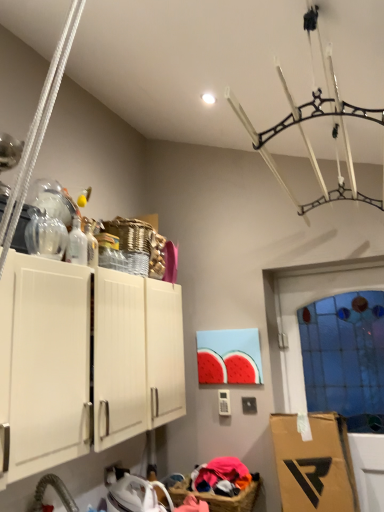
The width and height of the screenshot is (384, 512). What are the coordinates of `brown wicker basket at lower center` in the screenshot? It's located at (232, 499).

I want to click on basket behind the transparent glass bottle at upper left, placed as the 2th bottle when sorted from back to front, so click(232, 499).

From the image's perspective, which is above, brown wicker basket at lower center or transparent glass bottle at upper left, placed as the 2th bottle when sorted from back to front?

transparent glass bottle at upper left, placed as the 2th bottle when sorted from back to front, is shown above in the image.

In the scene shown: How distant is brown wicker basket at lower center from transparent glass bottle at upper left, placed as the 2th bottle when sorted from back to front?

4.37 feet.

Which is more to the right, brown wicker basket at lower center or transparent glass bottle at upper left, the first bottle viewed from the front?

brown wicker basket at lower center.

Which of these two, transparent glass door at right or transparent glass bottle at upper left, placed as the 2th bottle when sorted from back to front, is bigger?

Bigger between the two is transparent glass door at right.

Between transparent glass door at right and transparent glass bottle at upper left, placed as the 2th bottle when sorted from back to front, which one has smaller width?

transparent glass door at right is thinner.

Is transparent glass door at right to the right of transparent glass bottle at upper left, placed as the 2th bottle when sorted from back to front, from the viewer's perspective?

Indeed, transparent glass door at right is positioned on the right side of transparent glass bottle at upper left, placed as the 2th bottle when sorted from back to front.

Is transparent glass door at right behind transparent glass bottle at upper left, the first bottle viewed from the front?

Yes, it is.

Does transparent glass bottle at upper left, the first bottle viewed from the front, turn towards brown wicker basket at lower center?

No.

Considering the positions of point (84, 255) and point (219, 498), is point (84, 255) closer or farther from the camera than point (219, 498)?

Point (84, 255) appears to be closer to the viewer than point (219, 498).

Is transparent glass bottle at upper left, placed as the 2th bottle when sorted from back to front, bigger or smaller than brown wicker basket at lower center?

transparent glass bottle at upper left, placed as the 2th bottle when sorted from back to front, is smaller than brown wicker basket at lower center.

Is transparent glass bottle at upper left, the first bottle viewed from the front, surrounding brown wicker basket at lower center?

No, brown wicker basket at lower center is located outside of transparent glass bottle at upper left, the first bottle viewed from the front.

From the image's perspective, would you say clear glass bottle at upper left, the 1th bottle positioned from the back, is shown under white matte cabinet at upper left?

Incorrect, from the image's perspective, clear glass bottle at upper left, the 1th bottle positioned from the back, is higher than white matte cabinet at upper left.

From a real-world perspective, is clear glass bottle at upper left, placed as the 2th bottle when sorted from front to back, over white matte cabinet at upper left?

Yes, from a real-world perspective, clear glass bottle at upper left, placed as the 2th bottle when sorted from front to back, is on top of white matte cabinet at upper left.

Is clear glass bottle at upper left, the 1th bottle positioned from the back, in front of white matte cabinet at upper left?

No, it is not.

Looking at this image, how distant is clear glass bottle at upper left, placed as the 2th bottle when sorted from front to back, from transparent glass door at right?

clear glass bottle at upper left, placed as the 2th bottle when sorted from front to back, is 1.53 meters away from transparent glass door at right.

From the image's perspective, is clear glass bottle at upper left, placed as the 2th bottle when sorted from front to back, located above or below transparent glass door at right?

Based on their image positions, clear glass bottle at upper left, placed as the 2th bottle when sorted from front to back, is located above transparent glass door at right.

How many degrees apart are the facing directions of clear glass bottle at upper left, the 1th bottle positioned from the back, and transparent glass door at right?

There is a 93.2-degree angle between the facing directions of clear glass bottle at upper left, the 1th bottle positioned from the back, and transparent glass door at right.

Is the position of clear glass bottle at upper left, the 1th bottle positioned from the back, less distant than that of transparent glass door at right?

That is True.

Considering the sizes of clear glass bottle at upper left, placed as the 2th bottle when sorted from front to back, and brown wicker basket at lower center in the image, is clear glass bottle at upper left, placed as the 2th bottle when sorted from front to back, bigger or smaller than brown wicker basket at lower center?

clear glass bottle at upper left, placed as the 2th bottle when sorted from front to back, is smaller than brown wicker basket at lower center.

Can you confirm if clear glass bottle at upper left, the 1th bottle positioned from the back, is taller than brown wicker basket at lower center?

Indeed, clear glass bottle at upper left, the 1th bottle positioned from the back, has a greater height compared to brown wicker basket at lower center.

How much distance is there between clear glass bottle at upper left, the 1th bottle positioned from the back, and brown wicker basket at lower center?

The distance of clear glass bottle at upper left, the 1th bottle positioned from the back, from brown wicker basket at lower center is 4.27 feet.

Is brown wicker basket at lower center located within clear glass bottle at upper left, placed as the 2th bottle when sorted from front to back?

No, brown wicker basket at lower center is located outside of clear glass bottle at upper left, placed as the 2th bottle when sorted from front to back.

From the image's perspective, is brown wicker basket at lower center beneath white matte cabinet at upper left?

Yes, from the image's perspective, brown wicker basket at lower center is below white matte cabinet at upper left.

Considering the relative sizes of brown wicker basket at lower center and white matte cabinet at upper left in the image provided, is brown wicker basket at lower center bigger than white matte cabinet at upper left?

No, brown wicker basket at lower center is not bigger than white matte cabinet at upper left.

I want to click on basket located underneath the transparent glass bottle at upper left, the first bottle viewed from the front (from a real-world perspective), so click(232, 499).

From the image's perspective, starting from the transparent glass door at right, which bottle is the 2nd one above? Please provide its 2D coordinates.

[(77, 244)]

When comparing their distances from transparent glass bottle at upper left, the first bottle viewed from the front, does transparent glass door at right or brown wicker basket at lower center seem further?

transparent glass door at right lies further to transparent glass bottle at upper left, the first bottle viewed from the front, than the other object.

Considering their positions, is clear glass bottle at upper left, placed as the 2th bottle when sorted from front to back, positioned further to white matte cabinet at upper left than brown wicker basket at lower center?

brown wicker basket at lower center lies further to white matte cabinet at upper left than the other object.

Based on their spatial positions, is brown wicker basket at lower center or transparent glass door at right closer to white matte cabinet at upper left?

Among the two, brown wicker basket at lower center is located nearer to white matte cabinet at upper left.

When comparing their distances from clear glass bottle at upper left, the 1th bottle positioned from the back, does brown wicker basket at lower center or transparent glass bottle at upper left, the first bottle viewed from the front, seem further?

brown wicker basket at lower center.

In the scene shown: From the image, which object appears to be farther from transparent glass bottle at upper left, placed as the 2th bottle when sorted from back to front, clear glass bottle at upper left, placed as the 2th bottle when sorted from front to back, or white matte cabinet at upper left?

Among the two, white matte cabinet at upper left is located further to transparent glass bottle at upper left, placed as the 2th bottle when sorted from back to front.

From the image, which object appears to be farther from white matte cabinet at upper left, transparent glass door at right or transparent glass bottle at upper left, placed as the 2th bottle when sorted from back to front?

Among the two, transparent glass door at right is located further to white matte cabinet at upper left.

Based on their spatial positions, is clear glass bottle at upper left, placed as the 2th bottle when sorted from front to back, or transparent glass door at right further from brown wicker basket at lower center?

clear glass bottle at upper left, placed as the 2th bottle when sorted from front to back, is positioned further to the anchor brown wicker basket at lower center.

In the scene shown: Considering their positions, is brown wicker basket at lower center positioned closer to clear glass bottle at upper left, the 1th bottle positioned from the back, than transparent glass door at right?

brown wicker basket at lower center is positioned closer to the anchor clear glass bottle at upper left, the 1th bottle positioned from the back.

The height and width of the screenshot is (512, 384). What are the coordinates of `cabinetry between transparent glass bottle at upper left, the first bottle viewed from the front, and brown wicker basket at lower center in the up-down direction` in the screenshot? It's located at (84, 359).

This screenshot has height=512, width=384. I want to click on basket situated between transparent glass bottle at upper left, the first bottle viewed from the front, and transparent glass door at right from left to right, so click(x=232, y=499).

Locate an element on the screen. This screenshot has width=384, height=512. bottle between transparent glass bottle at upper left, the first bottle viewed from the front, and brown wicker basket at lower center vertically is located at coordinates (91, 246).

Locate an element on the screen. basket between white matte cabinet at upper left and transparent glass door at right is located at coordinates (232, 499).